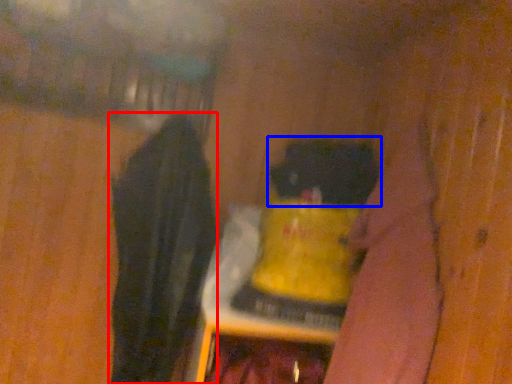
Question: Which object appears farthest to the camera in this image, clothing (highlighted by a red box) or animal (highlighted by a blue box)?

Choices:
 (A) clothing
 (B) animal

Answer: (B)